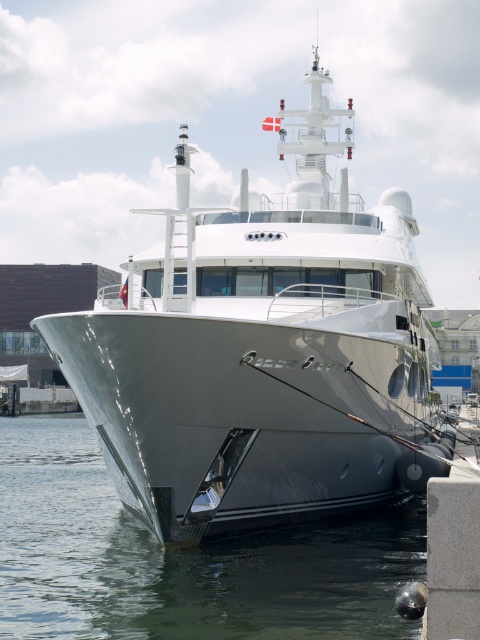
Between sleek metallic yacht at center and clear water at hull front, which one has more height?

With more height is sleek metallic yacht at center.

Is sleek metallic yacht at center to the left of clear water at hull front from the viewer's perspective?

In fact, sleek metallic yacht at center is to the right of clear water at hull front.

The image size is (480, 640). Describe the element at coordinates (263, 353) in the screenshot. I see `sleek metallic yacht at center` at that location.

I want to click on sleek metallic yacht at center, so click(x=263, y=353).